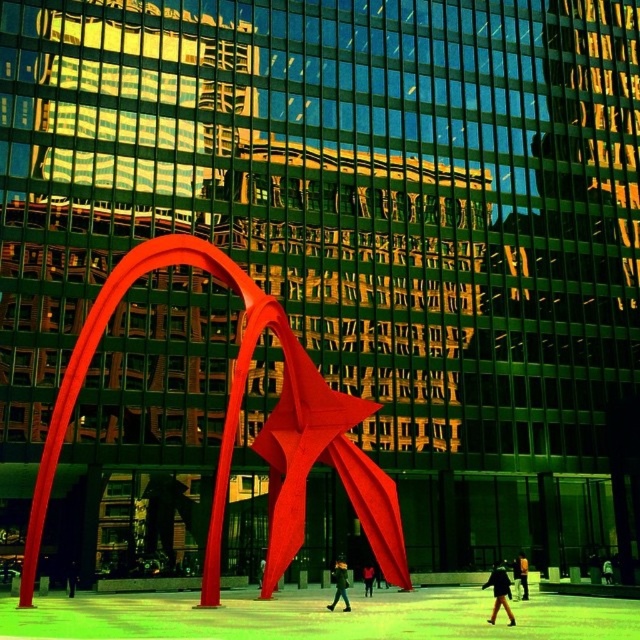
Is dark green fabric jacket at center thinner than black fabric person at center?

Indeed, dark green fabric jacket at center has a lesser width compared to black fabric person at center.

Between point (342, 573) and point (68, 577), which one is positioned behind?

Point (68, 577)

Between point (346, 604) and point (72, 582), which one is positioned in front?

Positioned in front is point (346, 604).

Identify the location of dark green fabric jacket at center. (339, 584).

Can you confirm if dark brown leather jacket at lower right is positioned below dark green fabric jacket at center?

Actually, dark brown leather jacket at lower right is above dark green fabric jacket at center.

Is dark brown leather jacket at lower right smaller than dark green fabric jacket at center?

Incorrect, dark brown leather jacket at lower right is not smaller in size than dark green fabric jacket at center.

Who is more distant from viewer, (496, 579) or (339, 592)?

Positioned behind is point (339, 592).

This screenshot has height=640, width=640. Identify the location of dark brown leather jacket at lower right. (499, 593).

Does dark green fabric jacket at center have a lesser height compared to black leather jacket at lower center?

Incorrect, dark green fabric jacket at center's height does not fall short of black leather jacket at lower center's.

Can you confirm if dark green fabric jacket at center is positioned to the right of black leather jacket at lower center?

No, dark green fabric jacket at center is not to the right of black leather jacket at lower center.

At what (x,y) coordinates should I click in order to perform the action: click on dark green fabric jacket at center. Please return your answer as a coordinate pair (x, y). The image size is (640, 640). Looking at the image, I should click on (339, 584).

This screenshot has width=640, height=640. In order to click on dark green fabric jacket at center in this screenshot , I will do `click(339, 584)`.